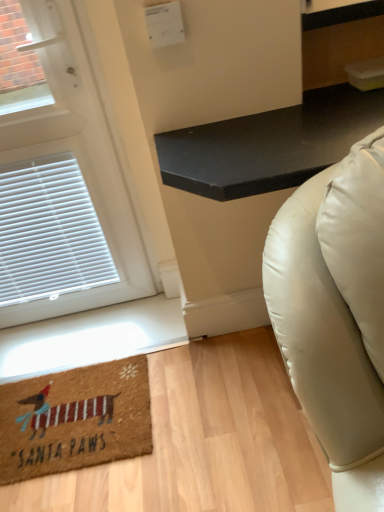
At what (x,y) coordinates should I click in order to perform the action: click on vacant space situated on the left part of black matte table at upper right. Please return your answer as a coordinate pair (x, y). This screenshot has width=384, height=512. Looking at the image, I should click on (156, 399).